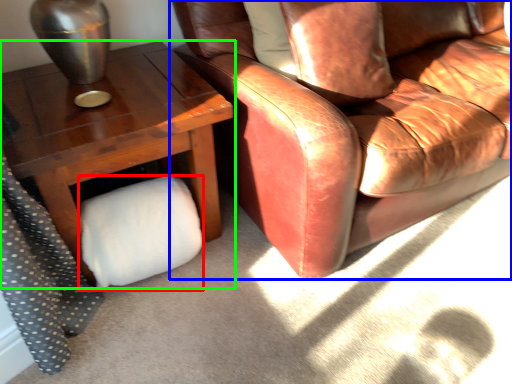
Question: Estimate the real-world distances between objects in this image. Which object is closer to toilet paper (highlighted by a red box), chair (highlighted by a blue box) or table (highlighted by a green box)?

Choices:
 (A) chair
 (B) table

Answer: (B)